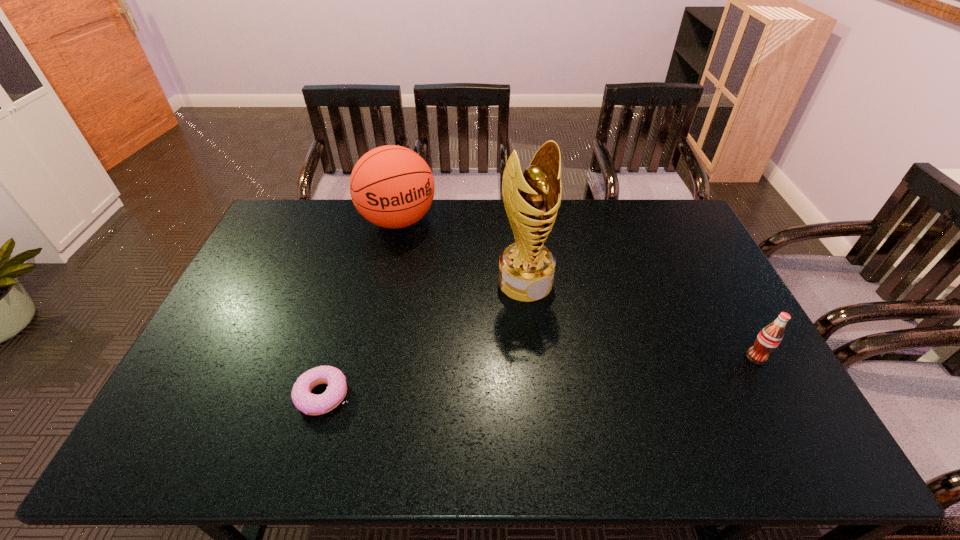
This screenshot has width=960, height=540. Identify the location of vacant region between the second object from right to left and the soda. (640, 320).

Where is `free point between the award and the soda`? free point between the award and the soda is located at coordinates (640, 320).

In order to click on vacant area that lies between the basketball and the third farthest object in this screenshot , I will do `click(577, 289)`.

What are the coordinates of `empty location between the soda and the tallest object` in the screenshot? It's located at (640, 320).

In order to click on object that is the second nearest to the nearest object in this screenshot , I will do `click(391, 186)`.

At what (x,y) coordinates should I click in order to perform the action: click on the closest object relative to the third farthest object. Please return your answer as a coordinate pair (x, y). Looking at the image, I should click on coord(526,268).

Locate an element on the screen. vacant area in the image that satisfies the following two spatial constraints: 1. on the back side of the nearest object; 2. on the left side of the third nearest object is located at coordinates (355, 282).

At what (x,y) coordinates should I click in order to perform the action: click on vacant space that satisfies the following two spatial constraints: 1. on the front side of the rightmost object; 2. on the left side of the tallest object. Please return your answer as a coordinate pair (x, y). This screenshot has width=960, height=540. Looking at the image, I should click on (533, 357).

The height and width of the screenshot is (540, 960). What are the coordinates of `free space that satisfies the following two spatial constraints: 1. on the back side of the farthest object; 2. on the right side of the doughnut` in the screenshot? It's located at (373, 221).

Where is `free location that satisfies the following two spatial constraints: 1. on the back side of the basketball; 2. on the left side of the shortest object`? This screenshot has width=960, height=540. free location that satisfies the following two spatial constraints: 1. on the back side of the basketball; 2. on the left side of the shortest object is located at coordinates (373, 221).